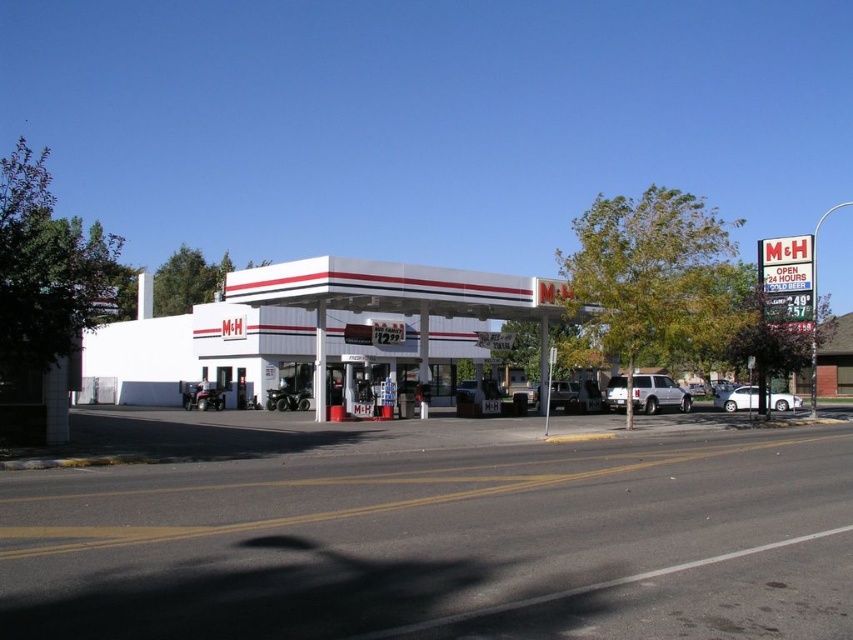
In the scene shown: You are driving a car that is 5 meters long. You want to park your car between the white matte gas station at center and the white matte suv at center. Is there enough space between them to park your car?

The distance between the white matte gas station at center and the white matte suv at center is 13.57 meters. Since your car is only 5 meters long, there is sufficient space to park between them.

You are driving a car and need to park next to the white matte gas station at center. There is a white matte suv at center already parked there. Which side of the SUV should you park on to be next to the gas station?

You should park to the right of the white matte suv at center because the white matte gas station at center is located to the left of the SUV.

You are a pedestrian standing at the entrance of the M<H gas station. You see a white matte suv at center and a white matte sedan at lower right. Which vehicle is nearer to you?

The white matte suv at center is closer to the viewer than the white matte sedan at lower right, so the white matte suv at center is nearer to you.